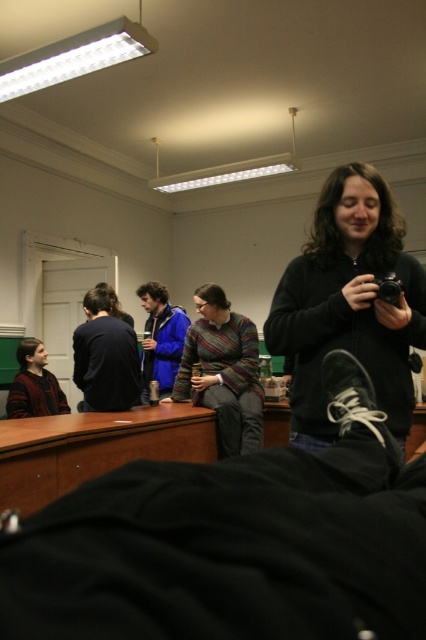
Does striped sweater at center have a greater width compared to blue fleece jacket at center?

Yes.

Does striped sweater at center have a larger size compared to blue fleece jacket at center?

Correct, striped sweater at center is larger in size than blue fleece jacket at center.

Identify the location of striped sweater at center. (224, 371).

Locate an element on the screen. This screenshot has width=426, height=640. striped sweater at center is located at coordinates (224, 371).

Does point (336, 280) come in front of point (58, 401)?

Yes, it is.

Find the location of `black matte sweater at center`. black matte sweater at center is located at coordinates (348, 304).

What do you see at coordinates (161, 339) in the screenshot? This screenshot has width=426, height=640. I see `blue fleece jacket at center` at bounding box center [161, 339].

Is blue fleece jacket at center further to the viewer compared to knitted sweater at lower left?

Yes, it is behind knitted sweater at lower left.

Between point (146, 369) and point (42, 387), which one is positioned in front?

Point (42, 387) is in front.

At what (x,y) coordinates should I click in order to perform the action: click on blue fleece jacket at center. Please return your answer as a coordinate pair (x, y). The width and height of the screenshot is (426, 640). Looking at the image, I should click on (161, 339).